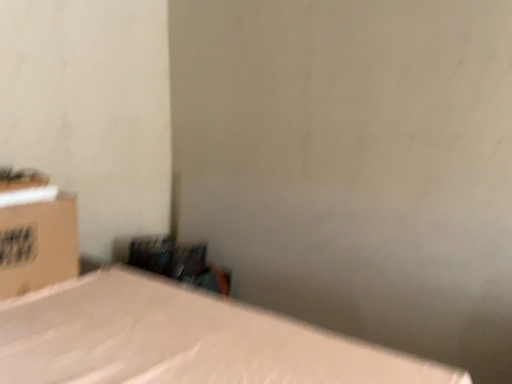
This screenshot has height=384, width=512. Describe the element at coordinates (38, 244) in the screenshot. I see `matte cardboard box at left` at that location.

In order to face matte cardboard box at left, should I rotate leftwards or rightwards?

You should rotate left by 28.585 degrees.

Measure the distance between matte cardboard box at left and camera.

They are 5.78 feet apart.

This screenshot has width=512, height=384. What are the coordinates of `matte cardboard box at left` in the screenshot? It's located at (38, 244).

The height and width of the screenshot is (384, 512). What are the coordinates of `matte cardboard box at left` in the screenshot? It's located at (x=38, y=244).